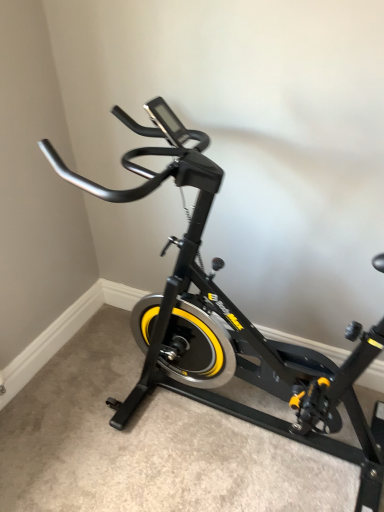
Find the location of a particular element. The width and height of the screenshot is (384, 512). black matte stationary bicycle at center is located at coordinates (232, 324).

The height and width of the screenshot is (512, 384). Describe the element at coordinates (232, 324) in the screenshot. I see `black matte stationary bicycle at center` at that location.

In the scene shown: What is the approximate height of black matte stationary bicycle at center?

The height of black matte stationary bicycle at center is 1.19 meters.

Locate an element on the screen. black matte stationary bicycle at center is located at coordinates (232, 324).